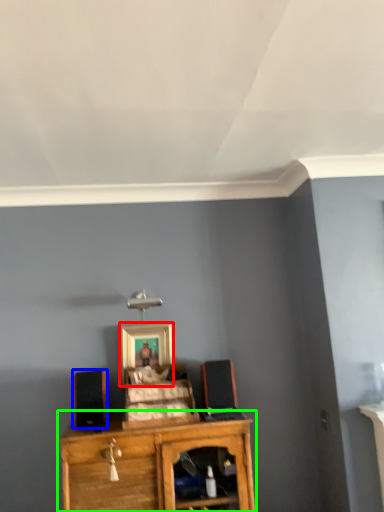
Question: Estimate the real-world distances between objects in this image. Which object is closer to picture frame (highlighted by a red box), speaker (highlighted by a blue box) or shelf (highlighted by a green box)?

Choices:
 (A) speaker
 (B) shelf

Answer: (A)